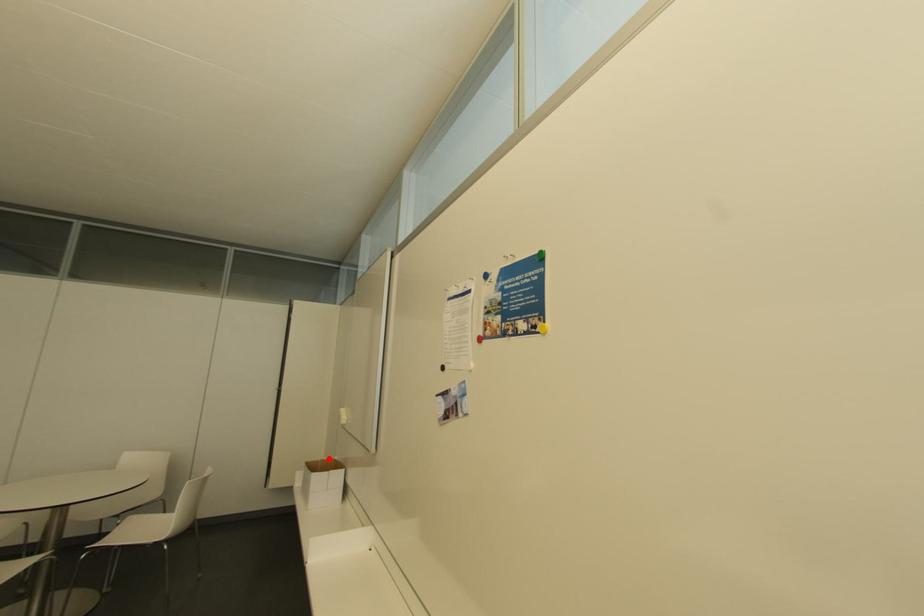
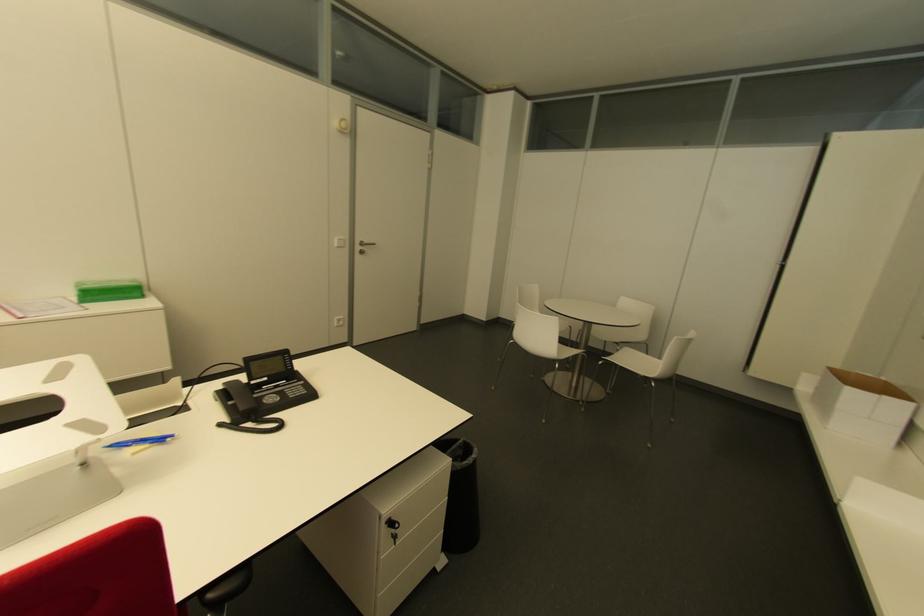
Where in the second image is the point corresponding to the highlighted location from the first image?

(868, 376)